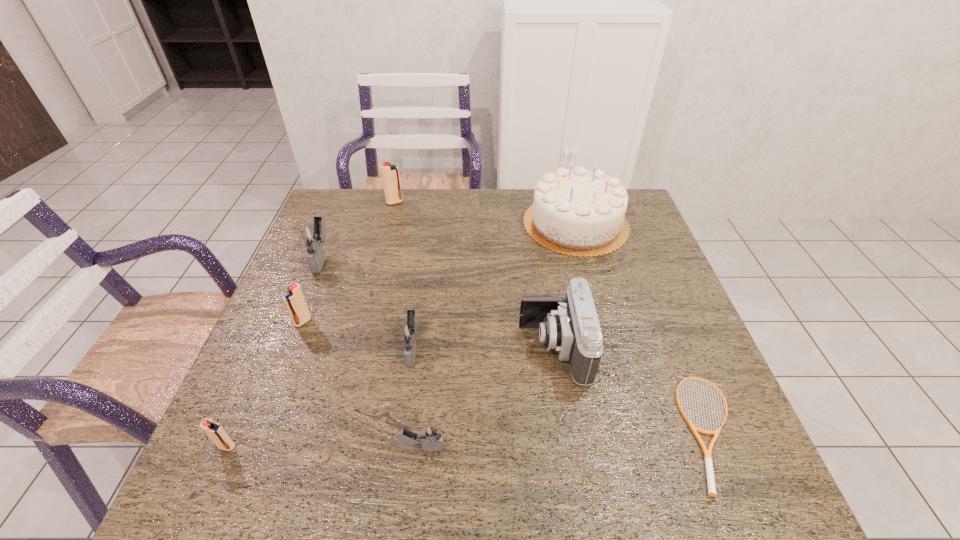
The width and height of the screenshot is (960, 540). In order to click on birthday cake in this screenshot , I will do `click(576, 212)`.

Find the location of `the rightmost red igniter`. the rightmost red igniter is located at coordinates (390, 173).

Find the location of `the fourth igniter from left to right`. the fourth igniter from left to right is located at coordinates (390, 173).

I want to click on the biggest gray igniter, so click(312, 235).

At what (x,y) coordinates should I click in order to perform the action: click on the fifth nearest igniter. Please return your answer as a coordinate pair (x, y). Looking at the image, I should click on (312, 235).

Image resolution: width=960 pixels, height=540 pixels. I want to click on camera, so click(x=570, y=325).

You are a GUI agent. You are given a task and a screenshot of the screen. Output one action in this format:
    pyautogui.click(x=<x>, y=<y>)
    Task: Click on the second farthest gray igniter
    Image resolution: width=960 pixels, height=540 pixels.
    Given the screenshot: What is the action you would take?
    pyautogui.click(x=410, y=332)

The height and width of the screenshot is (540, 960). Identify the location of the third nearest igniter. (410, 332).

Find the location of `the second red igniter from left to right`. the second red igniter from left to right is located at coordinates pos(294,300).

You are a GUI agent. You are given a task and a screenshot of the screen. Output one action in this format:
    pyautogui.click(x=<x>, y=<y>)
    Task: Click on the second smallest red igniter
    This screenshot has width=960, height=540.
    Given the screenshot: What is the action you would take?
    pyautogui.click(x=294, y=300)